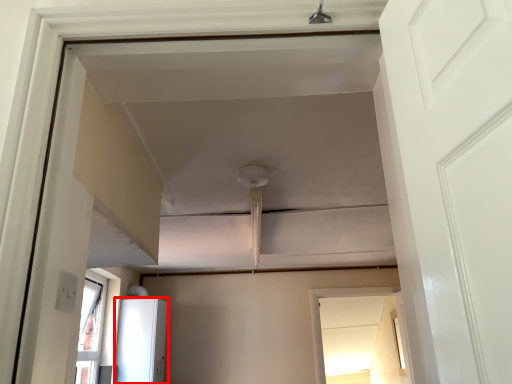
Question: Considering the relative positions of appliance (annotated by the red box) and window in the image provided, where is appliance (annotated by the red box) located with respect to the staircase?

Choices:
 (A) left
 (B) right

Answer: (A)